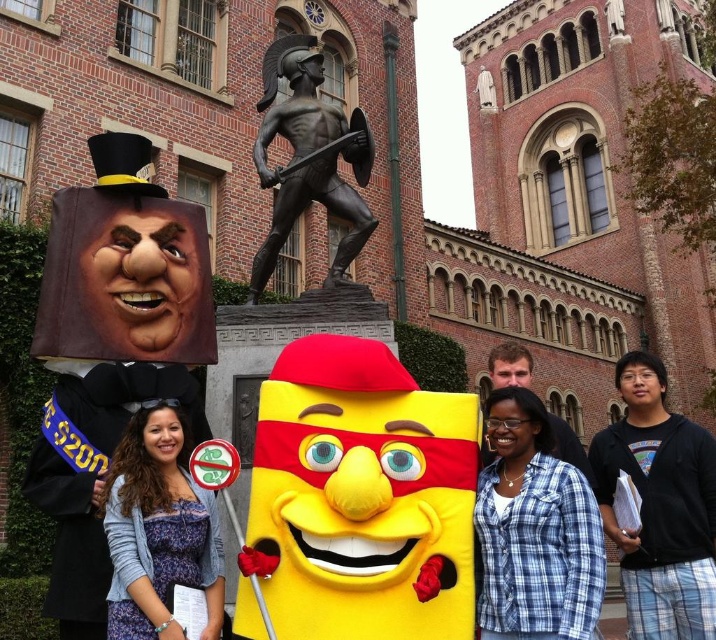
Is black cotton shirt at lower right smaller than bronze warrior at center?

Indeed, black cotton shirt at lower right has a smaller size compared to bronze warrior at center.

Is point (626, 435) positioned before point (291, 196)?

Yes, it is in front of point (291, 196).

Locate an element on the screen. black cotton shirt at lower right is located at coordinates (659, 506).

Is black cotton shirt at lower right further to camera compared to matte purple dress at center?

Yes, black cotton shirt at lower right is behind matte purple dress at center.

Does point (677, 513) lie behind point (195, 529)?

Yes, it is behind point (195, 529).

I want to click on black cotton shirt at lower right, so click(x=659, y=506).

Identify the location of black cotton shirt at lower right. (659, 506).

Is black cotton shirt at lower right above blue plaid shirt at lower right?

No, black cotton shirt at lower right is not above blue plaid shirt at lower right.

In the scene shown: Between black cotton shirt at lower right and blue plaid shirt at lower right, which one is positioned lower?

black cotton shirt at lower right is below.

Is point (672, 554) in front of point (508, 556)?

No, it is not.

Image resolution: width=716 pixels, height=640 pixels. What are the coordinates of `black cotton shirt at lower right` in the screenshot? It's located at (659, 506).